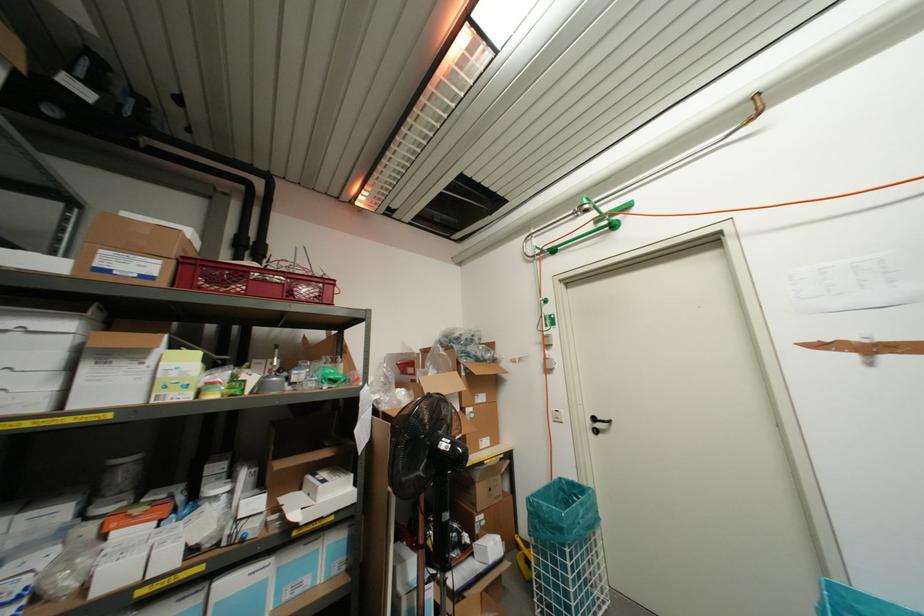
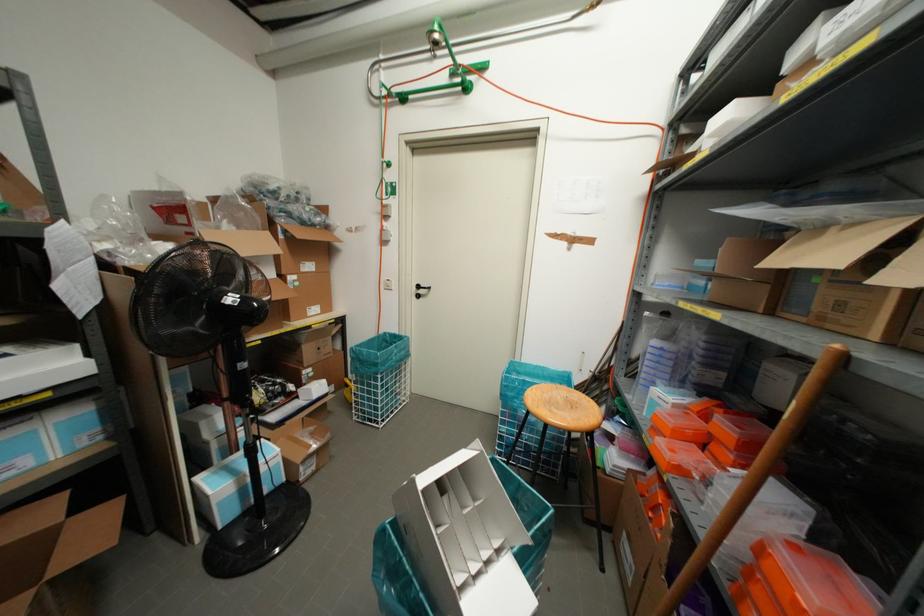
Where in the second image is the point corresponding to point (551, 416) from the first image?

(382, 285)